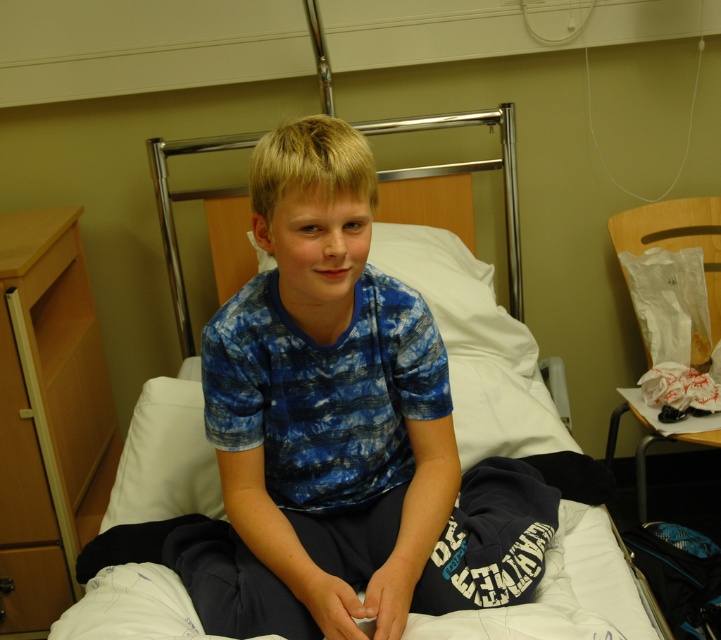
Question: Which object is the farthest from the blue tie-dye t-shirt at center?

Choices:
 (A) white fabric hospital bed at center
 (B) blue tie-dye shirt at center

Answer: (A)

Question: Which of the following is the farthest from the observer?

Choices:
 (A) (345, 452)
 (B) (559, 579)

Answer: (A)

Question: Is blue tie-dye t-shirt at center below white fabric hospital bed at center?

Choices:
 (A) no
 (B) yes

Answer: (A)

Question: Among these objects, which one is farthest from the camera?

Choices:
 (A) white soft pillow at center
 (B) blue tie-dye t-shirt at center
 (C) blue tie-dye shirt at center

Answer: (A)

Question: Does blue tie-dye t-shirt at center appear under white soft pillow at center?

Choices:
 (A) no
 (B) yes

Answer: (B)

Question: Can you confirm if blue tie-dye shirt at center is smaller than blue tie-dye t-shirt at center?

Choices:
 (A) no
 (B) yes

Answer: (A)